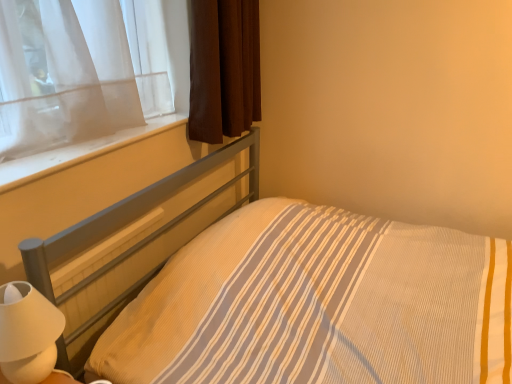
The height and width of the screenshot is (384, 512). I want to click on white matte table lamp at lower left, so click(x=28, y=333).

Measure the distance between point (28, 351) and camera.

The depth of point (28, 351) is 32.83 inches.

Describe the element at coordinates (223, 68) in the screenshot. This screenshot has width=512, height=384. I see `brown fabric curtain at upper left` at that location.

Locate an element on the screen. This screenshot has width=512, height=384. white smooth window sill at upper left is located at coordinates (79, 152).

From the image's perspective, is yellow striped fabric at center on top of brown fabric curtain at upper left?

No.

Who is bigger, yellow striped fabric at center or brown fabric curtain at upper left?

yellow striped fabric at center is bigger.

Does yellow striped fabric at center have a greater height compared to brown fabric curtain at upper left?

Yes, yellow striped fabric at center is taller than brown fabric curtain at upper left.

Is yellow striped fabric at center aimed at brown fabric curtain at upper left?

No.

From the image's perspective, between white matte table lamp at lower left and brown fabric curtain at upper left, which one is located above?

brown fabric curtain at upper left appears higher in the image.

Who is smaller, white matte table lamp at lower left or brown fabric curtain at upper left?

Smaller between the two is white matte table lamp at lower left.

Which of these two, white matte table lamp at lower left or brown fabric curtain at upper left, stands shorter?

white matte table lamp at lower left is shorter.

Consider the image. Would you say white matte table lamp at lower left is inside or outside brown fabric curtain at upper left?

white matte table lamp at lower left is spatially situated outside brown fabric curtain at upper left.

From the picture: From a real-world perspective, is white smooth window sill at upper left positioned under yellow striped fabric at center based on gravity?

Incorrect, from a real-world perspective, white smooth window sill at upper left is higher than yellow striped fabric at center.

Which of these two, white smooth window sill at upper left or yellow striped fabric at center, is bigger?

Bigger between the two is yellow striped fabric at center.

From the image's perspective, between white smooth window sill at upper left and yellow striped fabric at center, which one is located above?

white smooth window sill at upper left is shown above in the image.

Could you tell me if white smooth window sill at upper left is facing yellow striped fabric at center?

No, white smooth window sill at upper left is not facing towards yellow striped fabric at center.

Is yellow striped fabric at center not within white smooth window sill at upper left?

Yes, yellow striped fabric at center is located beyond the bounds of white smooth window sill at upper left.

From a real-world perspective, between yellow striped fabric at center and white smooth window sill at upper left, who is vertically higher?

white smooth window sill at upper left.

Is yellow striped fabric at center thinner than white smooth window sill at upper left?

No, yellow striped fabric at center is not thinner than white smooth window sill at upper left.

Is yellow striped fabric at center aimed at white smooth window sill at upper left?

No, yellow striped fabric at center is not aimed at white smooth window sill at upper left.

Is white smooth window sill at upper left in contact with white matte table lamp at lower left?

No, white smooth window sill at upper left is not touching white matte table lamp at lower left.

Considering the positions of point (165, 126) and point (54, 309), is point (165, 126) closer or farther from the camera than point (54, 309)?

Point (165, 126) appears to be farther away from the viewer than point (54, 309).

From a real-world perspective, is white smooth window sill at upper left positioned above or below white matte table lamp at lower left?

From a real-world perspective, white smooth window sill at upper left is physically above white matte table lamp at lower left.

Considering the relative positions of white smooth window sill at upper left and white matte table lamp at lower left in the image provided, is white smooth window sill at upper left to the left or to the right of white matte table lamp at lower left?

In the image, white smooth window sill at upper left appears on the left side of white matte table lamp at lower left.

Considering the positions of objects white matte table lamp at lower left and yellow striped fabric at center in the image provided, who is behind, white matte table lamp at lower left or yellow striped fabric at center?

white matte table lamp at lower left is more distant.

Is white matte table lamp at lower left directly adjacent to yellow striped fabric at center?

No, white matte table lamp at lower left is not beside yellow striped fabric at center.

Which is in front, point (14, 328) or point (31, 259)?

Positioned in front is point (14, 328).

This screenshot has height=384, width=512. What are the coordinates of `table lamp above the yellow striped fabric at center (from a real-world perspective)` in the screenshot? It's located at (28, 333).

Is point (0, 311) closer to viewer compared to point (51, 154)?

Yes, it is.

Who is taller, white matte table lamp at lower left or white smooth window sill at upper left?

white matte table lamp at lower left is taller.

Could you tell me if white matte table lamp at lower left is turned towards white smooth window sill at upper left?

No, white matte table lamp at lower left does not turn towards white smooth window sill at upper left.

Locate an element on the screen. This screenshot has width=512, height=384. curtain on the left of yellow striped fabric at center is located at coordinates (223, 68).

Locate an element on the screen. table lamp below the brown fabric curtain at upper left (from a real-world perspective) is located at coordinates (28, 333).

Considering their positions, is yellow striped fabric at center positioned further to white matte table lamp at lower left than white smooth window sill at upper left?

white smooth window sill at upper left lies further to white matte table lamp at lower left than the other object.

Estimate the real-world distances between objects in this image. Which object is closer to white matte table lamp at lower left, white smooth window sill at upper left or yellow striped fabric at center?

The object closer to white matte table lamp at lower left is yellow striped fabric at center.

From the image, which object appears to be nearer to white smooth window sill at upper left, yellow striped fabric at center or brown fabric curtain at upper left?

yellow striped fabric at center is positioned closer to the anchor white smooth window sill at upper left.

Based on their spatial positions, is white matte table lamp at lower left or brown fabric curtain at upper left further from yellow striped fabric at center?

white matte table lamp at lower left is further to yellow striped fabric at center.

Estimate the real-world distances between objects in this image. Which object is closer to white matte table lamp at lower left, yellow striped fabric at center or brown fabric curtain at upper left?

yellow striped fabric at center lies closer to white matte table lamp at lower left than the other object.

Considering their positions, is white matte table lamp at lower left positioned further to brown fabric curtain at upper left than yellow striped fabric at center?

white matte table lamp at lower left is positioned further to the anchor brown fabric curtain at upper left.

Considering their positions, is brown fabric curtain at upper left positioned further to white smooth window sill at upper left than white matte table lamp at lower left?

white matte table lamp at lower left is further to white smooth window sill at upper left.

From the image, which object appears to be nearer to white smooth window sill at upper left, white matte table lamp at lower left or yellow striped fabric at center?

yellow striped fabric at center is positioned closer to the anchor white smooth window sill at upper left.

The width and height of the screenshot is (512, 384). I want to click on table lamp between white smooth window sill at upper left and yellow striped fabric at center, so click(28, 333).

Where is `window sill between brown fabric curtain at upper left and white matte table lamp at lower left from top to bottom`? The image size is (512, 384). window sill between brown fabric curtain at upper left and white matte table lamp at lower left from top to bottom is located at coordinates (79, 152).

Locate an element on the screen. The width and height of the screenshot is (512, 384). table lamp between brown fabric curtain at upper left and yellow striped fabric at center from top to bottom is located at coordinates (28, 333).

The width and height of the screenshot is (512, 384). I want to click on window sill located between yellow striped fabric at center and brown fabric curtain at upper left in the depth direction, so click(x=79, y=152).